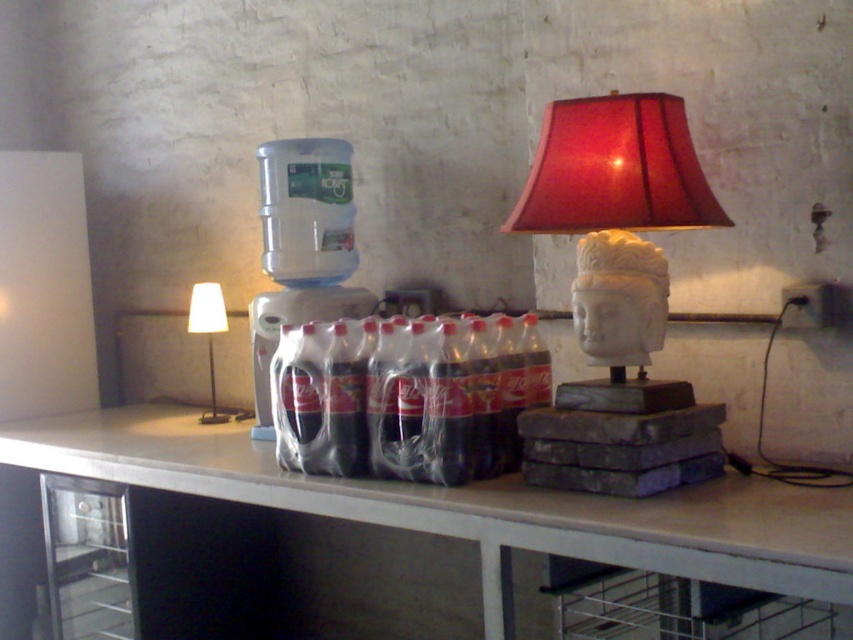
You are standing in the room and want to place a book on the white concrete table at center. Can you see the white fabric lampshade at left from the table?

Yes, because the white concrete table at center is in front of the white fabric lampshade at left, so the lampshade would be visible behind the table.

You are organizing a party and need to place a large centerpiece on the table. Given the white concrete table at center and the matte white head at upper right, which surface can accommodate the centerpiece without it falling off?

The white concrete table at center is bigger than the matte white head at upper right, so the centerpiece can be placed on the white concrete table at center as it has a larger surface area to prevent it from falling off.

You are standing in the room and want to place a book on the white concrete table at center. However, there is a white fabric lampshade at left hanging above it. Can you place the book directly on the table without it being under the lampshade?

The white concrete table at center is below the white fabric lampshade at left, so placing the book directly on the table would position it under the lampshade. Therefore, you cannot place the book there without it being under the lampshade.